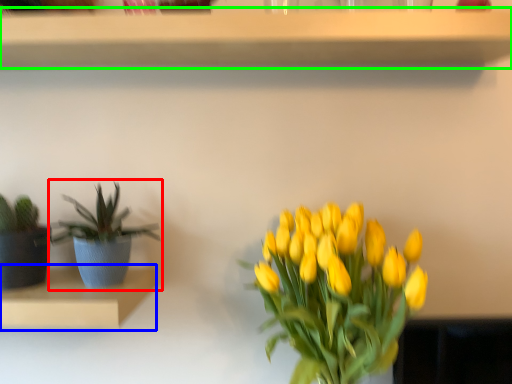
Question: Which object is positioned closest to houseplant (highlighted by a red box)? Select from shelf (highlighted by a blue box) and shelf (highlighted by a green box).

Choices:
 (A) shelf
 (B) shelf

Answer: (A)